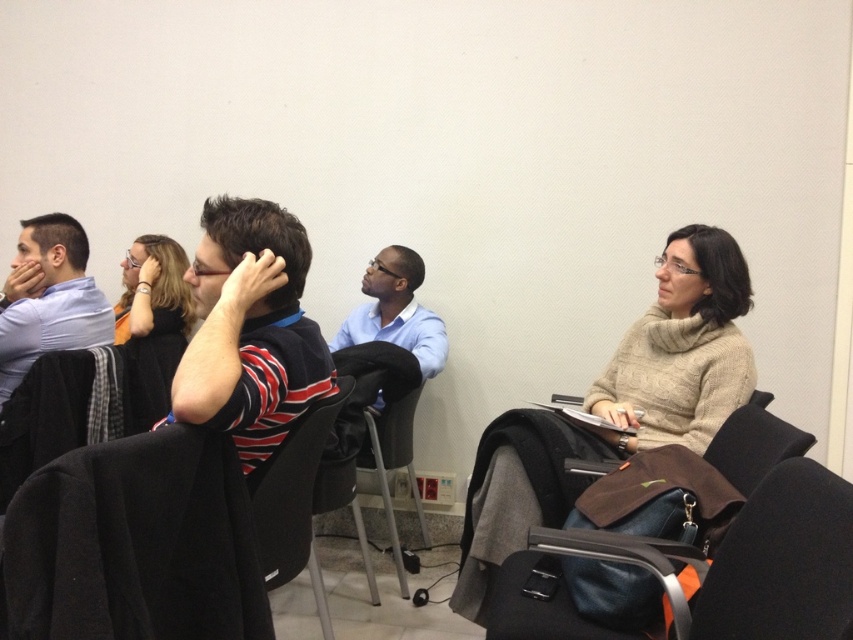
You are standing at the center of the conference room and want to sit in the black leather chair at lower right. Based on the coordinates provided, which direction should you move to reach it?

The black leather chair at lower right is located at coordinates point [782,561]. Since the coordinates are in the lower right quadrant, you should move towards the lower right direction to reach it.

You are sitting in the black leather chair at lower right and want to move to the black fabric chair at center. Can you stand up without moving the chair?

The black leather chair at lower right is positioned under the black fabric chair at center, so standing up might be difficult due to limited space between them. You should check the distance before attempting to move.

You are a person standing at the entrance of the conference room. You want to move to the matte black hair at upper left without disturbing others. The black fabric chair at center is in your way. Can you walk around it? Please explain.

The black fabric chair at center is 1.23 meters away from matte black hair at upper left. Since the chair is only 1.23 meters away from the target, you can easily walk around it without disturbing others as long as you maintain a safe distance.